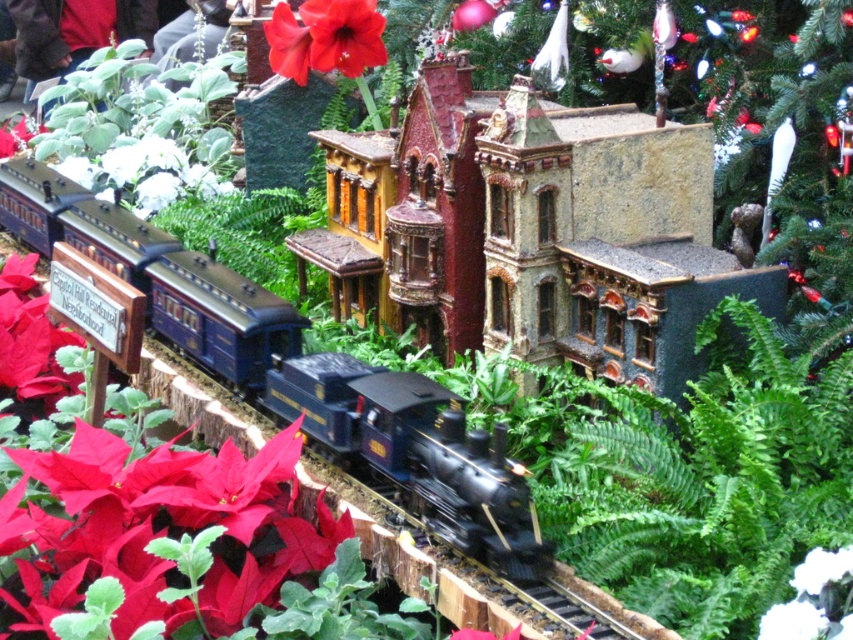
Which of these two, shiny blue locomotive at center or red matte poinsettia at upper center, stands taller?

shiny blue locomotive at center

Between shiny blue locomotive at center and red matte poinsettia at upper center, which one is positioned lower?

shiny blue locomotive at center is below.

Is point (173, 323) behind point (332, 4)?

No, (173, 323) is in front of (332, 4).

In order to click on shiny blue locomotive at center in this screenshot , I will do `click(300, 374)`.